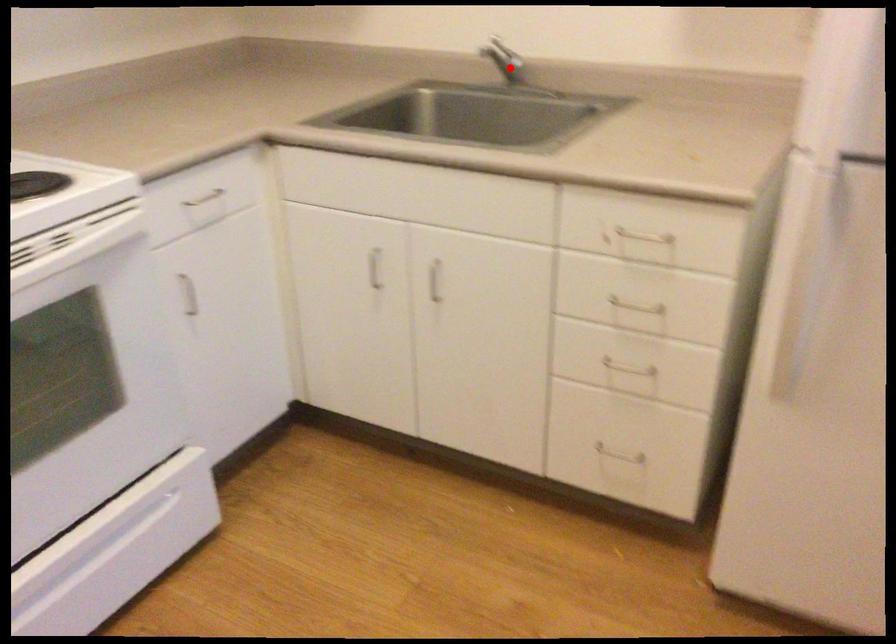
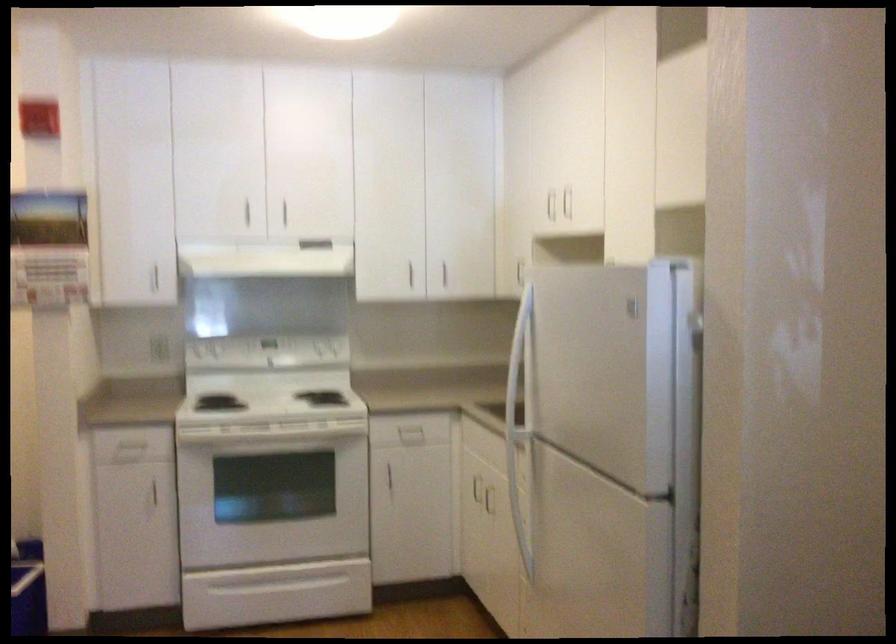
Question: I am providing you with two images of the same scene from different viewpoints. A red point is marked on the first image. Is the red point's position out of view in image 2?

Choices:
 (A) Yes
 (B) No

Answer: (A)